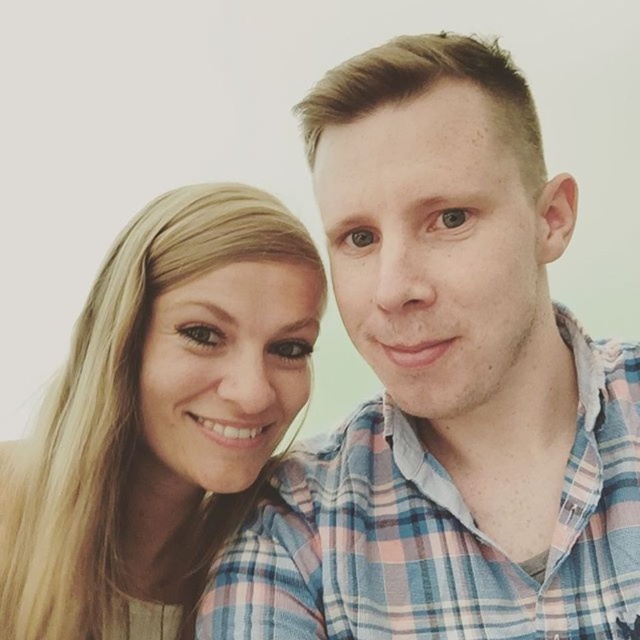
Question: Which point is farther to the camera?

Choices:
 (A) (397, 250)
 (B) (157, 205)

Answer: (B)

Question: Which point is closer to the camera?

Choices:
 (A) (445, 234)
 (B) (148, 522)

Answer: (A)

Question: Can you confirm if plaid shirt at center is bigger than blonde hair at upper left?

Choices:
 (A) yes
 (B) no

Answer: (A)

Question: Does plaid shirt at center lie behind blonde hair at upper left?

Choices:
 (A) no
 (B) yes

Answer: (A)

Question: Among these points, which one is farthest from the camera?

Choices:
 (A) (435, 49)
 (B) (83, 344)

Answer: (B)

Question: Is plaid shirt at center to the left of blonde hair at upper left from the viewer's perspective?

Choices:
 (A) yes
 (B) no

Answer: (B)